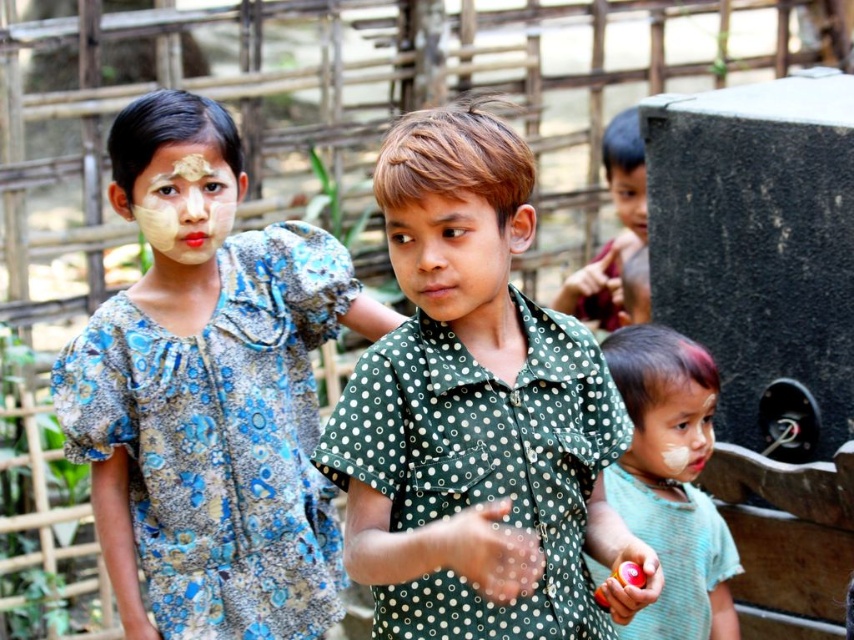
The width and height of the screenshot is (854, 640). Identify the location of light blue cotton shirt at lower right. (671, 481).

Does green dotted shirt at center appear under matte yellow face at upper left?

Correct, green dotted shirt at center is located below matte yellow face at upper left.

Does green dotted shirt at center appear over matte yellow face at upper left?

No, green dotted shirt at center is not above matte yellow face at upper left.

Between point (525, 412) and point (192, 209), which one is positioned behind?

The point (192, 209) is more distant.

The image size is (854, 640). Identify the location of green dotted shirt at center. (477, 413).

From the picture: Does green dotted shirt at center have a greater height compared to light blue cotton shirt at lower right?

Yes, green dotted shirt at center is taller than light blue cotton shirt at lower right.

Identify the location of green dotted shirt at center. The image size is (854, 640). click(x=477, y=413).